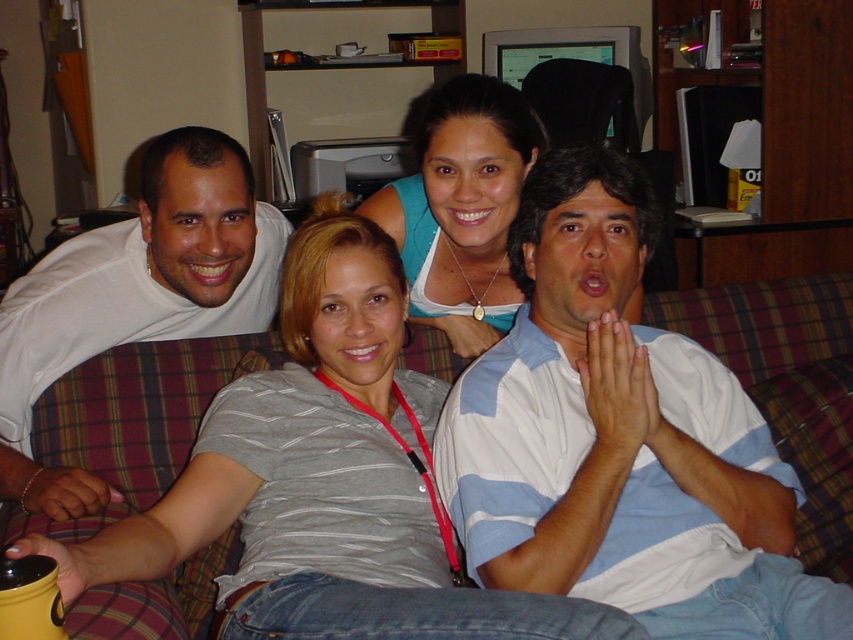
Does point (598, 291) lie behind point (6, 332)?

No, it is in front of (6, 332).

Which is more to the right, white striped shirt at center or white matte shirt at upper left?

From the viewer's perspective, white striped shirt at center appears more on the right side.

Does point (619, 600) come behind point (152, 172)?

No, it is not.

This screenshot has width=853, height=640. Find the location of `white striped shirt at center`. white striped shirt at center is located at coordinates (619, 438).

Which of these two, white matte shirt at upper left or matte blue tank top at center, stands shorter?

matte blue tank top at center is shorter.

Does white matte shirt at upper left have a larger size compared to matte blue tank top at center?

Correct, white matte shirt at upper left is larger in size than matte blue tank top at center.

Is point (22, 337) positioned before point (480, 196)?

Yes, it is.

I want to click on white matte shirt at upper left, so click(135, 296).

Does white striped shirt at center lie behind matte blue tank top at center?

No, it is in front of matte blue tank top at center.

Locate an element on the screen. This screenshot has width=853, height=640. white striped shirt at center is located at coordinates tap(619, 438).